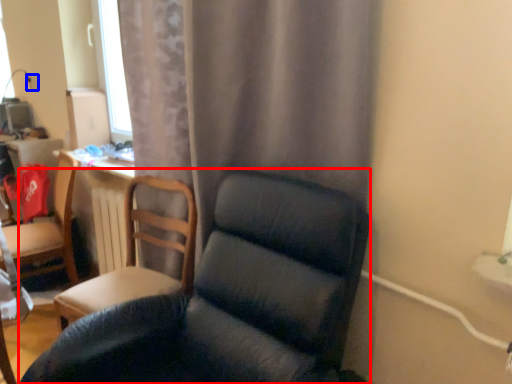
Question: Which object is closer to the camera taking this photo, chair (highlighted by a red box) or electric outlet (highlighted by a blue box)?

Choices:
 (A) chair
 (B) electric outlet

Answer: (A)